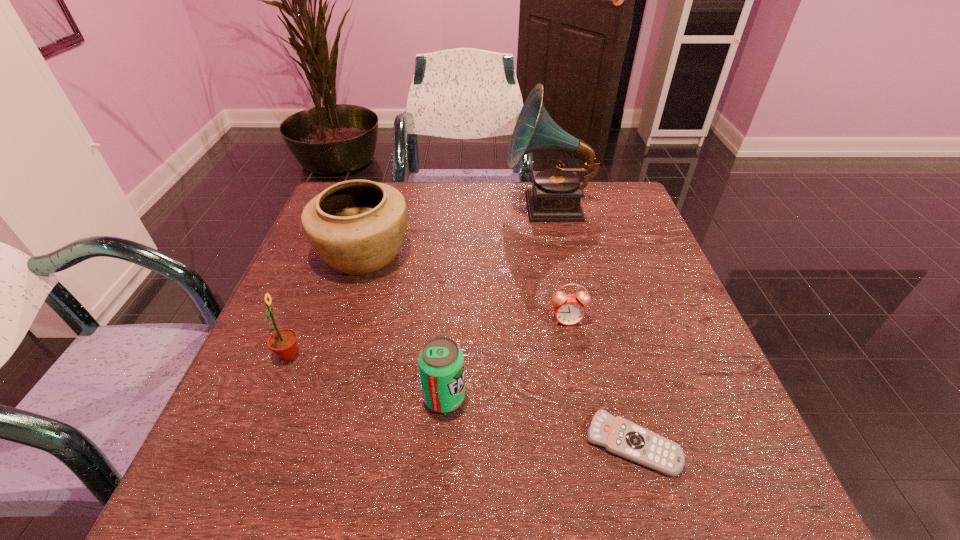
I want to click on vacant space that satisfies the following two spatial constraints: 1. on the front-facing side of the pop soda; 2. on the right side of the remote control, so click(442, 444).